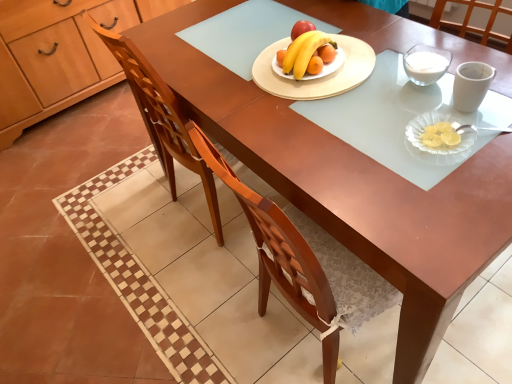
Where is `free point behind wooden round platter at center, which is counted as the first platter, starting from the left`? free point behind wooden round platter at center, which is counted as the first platter, starting from the left is located at coordinates (270, 22).